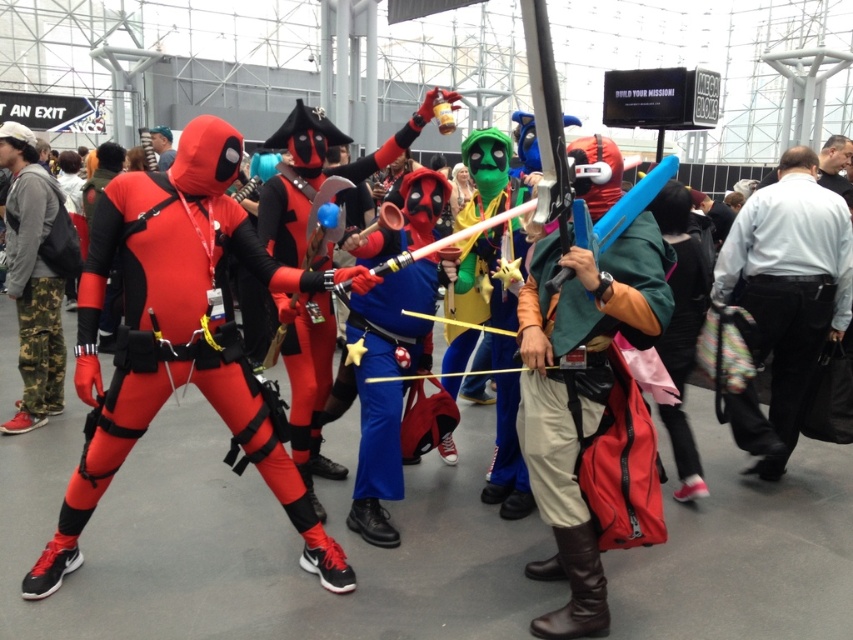
Does camo pants at left have a larger size compared to black leather jacket at upper right?

Actually, camo pants at left might be smaller than black leather jacket at upper right.

The image size is (853, 640). Find the location of `camo pants at left`. camo pants at left is located at coordinates (36, 275).

Between point (19, 365) and point (846, 198), which one is positioned behind?

Positioned behind is point (846, 198).

Identify the location of camo pants at left. The width and height of the screenshot is (853, 640). (36, 275).

Does black leather jacket at upper right lie behind matte black shirt at upper center?

No.

Is black leather jacket at upper right to the left of matte black shirt at upper center from the viewer's perspective?

In fact, black leather jacket at upper right is to the right of matte black shirt at upper center.

Who is more forward, (x=840, y=150) or (x=161, y=147)?

Positioned in front is point (x=840, y=150).

Locate an element on the screen. The width and height of the screenshot is (853, 640). black leather jacket at upper right is located at coordinates (834, 164).

The width and height of the screenshot is (853, 640). I want to click on light blue shirt at right, so click(x=785, y=296).

Describe the element at coordinates (785, 296) in the screenshot. I see `light blue shirt at right` at that location.

You are a GUI agent. You are given a task and a screenshot of the screen. Output one action in this format:
    pyautogui.click(x=<x>, y=<y>)
    Task: Click on the light blue shirt at right
    
    Given the screenshot: What is the action you would take?
    pyautogui.click(x=785, y=296)